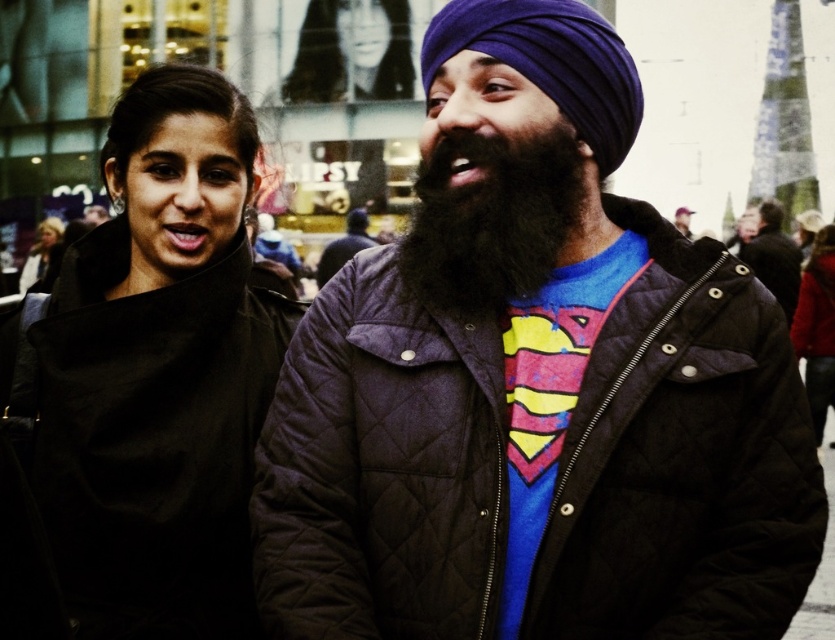
Does dark brown thick beard at center appear on the left side of quilted black jacket at right?

Correct, you'll find dark brown thick beard at center to the left of quilted black jacket at right.

Is dark brown thick beard at center shorter than quilted black jacket at right?

Correct, dark brown thick beard at center is not as tall as quilted black jacket at right.

Find the location of `dark brown thick beard at center`. dark brown thick beard at center is located at coordinates (489, 220).

Find the location of a particular element. This screenshot has height=640, width=835. dark brown thick beard at center is located at coordinates (489, 220).

Measure the distance from purple fabric turban at upper center to smooth black hair at upper center.

purple fabric turban at upper center is 48.94 meters from smooth black hair at upper center.

Describe the element at coordinates (550, 61) in the screenshot. This screenshot has height=640, width=835. I see `purple fabric turban at upper center` at that location.

What do you see at coordinates (550, 61) in the screenshot? I see `purple fabric turban at upper center` at bounding box center [550, 61].

You are a GUI agent. You are given a task and a screenshot of the screen. Output one action in this format:
    pyautogui.click(x=<x>, y=<y>)
    Task: Click on the purple fabric turban at upper center
    
    Given the screenshot: What is the action you would take?
    pyautogui.click(x=550, y=61)

What do you see at coordinates (489, 220) in the screenshot?
I see `dark brown thick beard at center` at bounding box center [489, 220].

Can you confirm if dark brown thick beard at center is bigger than black quilted jacket at center?

Indeed, dark brown thick beard at center has a larger size compared to black quilted jacket at center.

Locate an element on the screen. The width and height of the screenshot is (835, 640). dark brown thick beard at center is located at coordinates (489, 220).